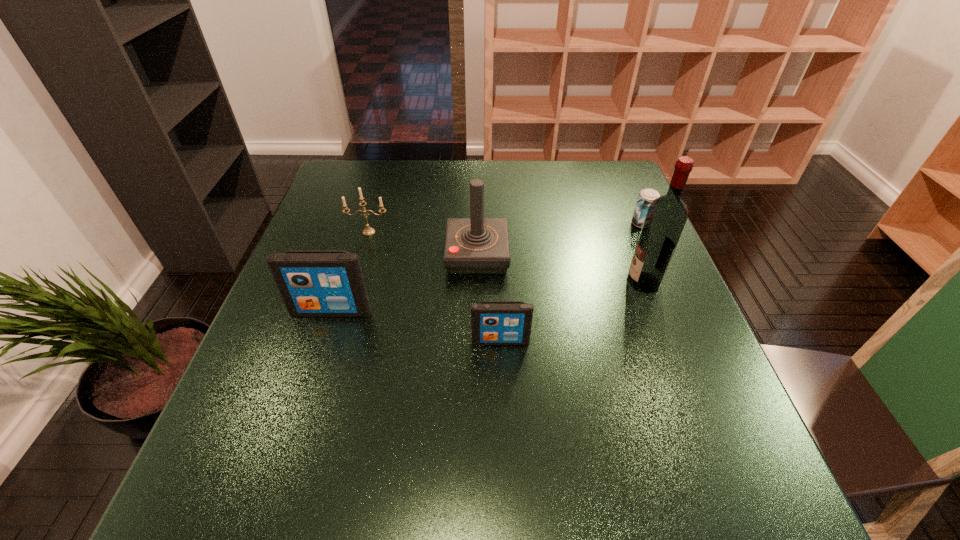
Please point a spot on the right to add another iPod. Please provide its 2D coordinates. Your answer should be formatted as a tuple, i.e. [(x, y)], where the tuple contains the x and y coordinates of a point satisfying the conditions above.

[(692, 375)]